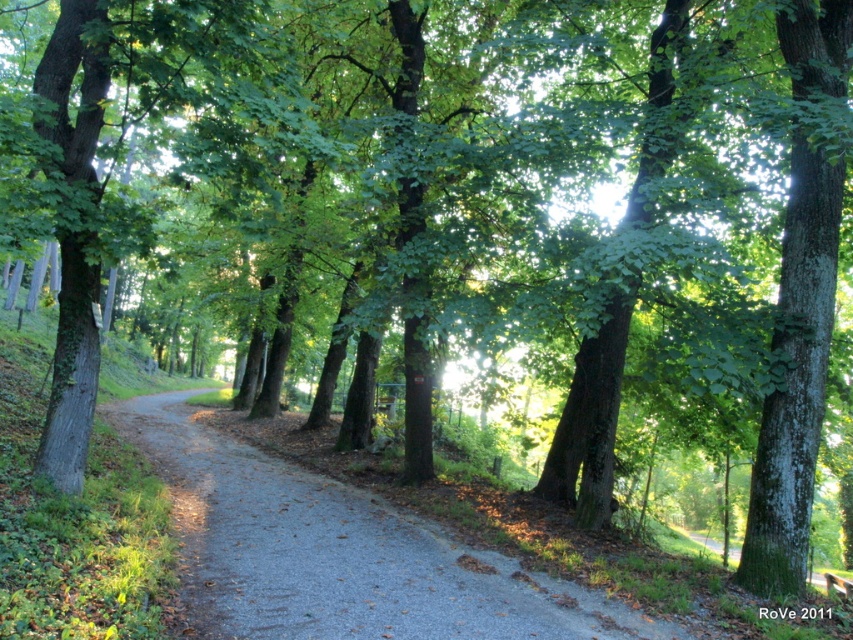
You are standing at the point with coordinates point (799,19) and want to walk to the point with coordinates point (447,620). Based on the scene description, will you be moving towards or away from the path?

Point (447,620) is in front of point (799,19), so moving towards the path.

You are standing on the gray gravel path at center and want to take a photo of the green rough bark tree at right. Since the tree is behind the path, will it be partially hidden by the path in your photo?

The gray gravel path at center is closer to the viewer than the green rough bark tree at right, so the tree will not be hidden by the path in the photo because the path is in front of the tree.